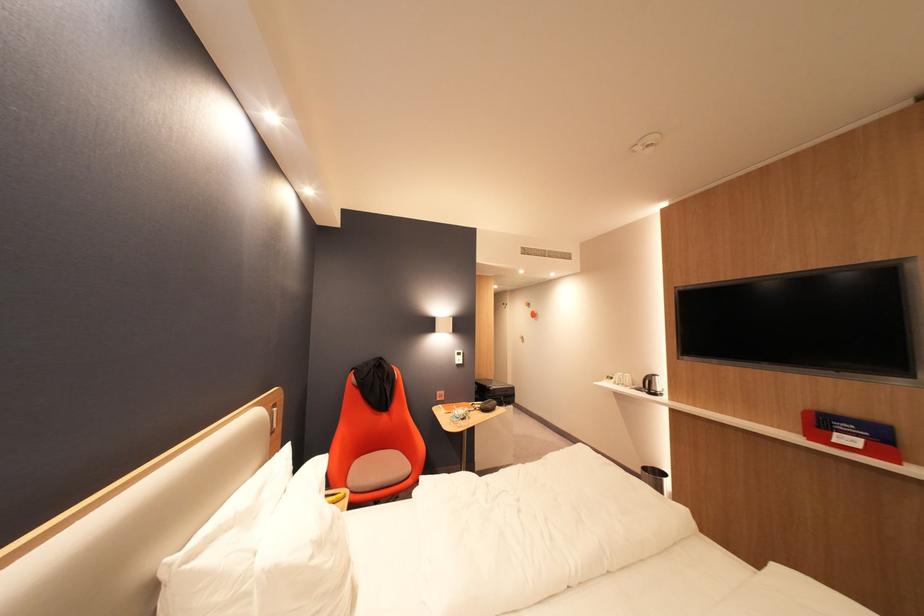
What do you see at coordinates (458, 357) in the screenshot?
I see `a white light switch` at bounding box center [458, 357].